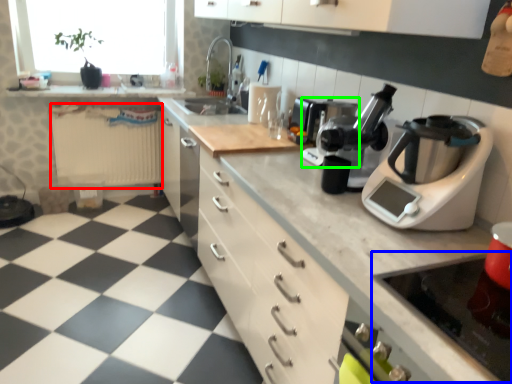
Question: Which is farther away from radiator (highlighted by a red box)? gas stove (highlighted by a blue box) or coffee machine (highlighted by a green box)?

Choices:
 (A) gas stove
 (B) coffee machine

Answer: (A)